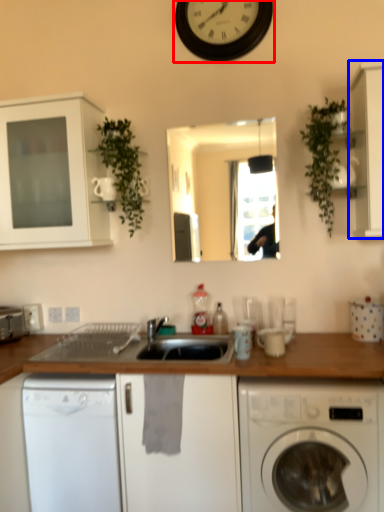
Question: Which point is further to the camera, clock (highlighted by a red box) or cabinetry (highlighted by a blue box)?

Choices:
 (A) clock
 (B) cabinetry

Answer: (A)